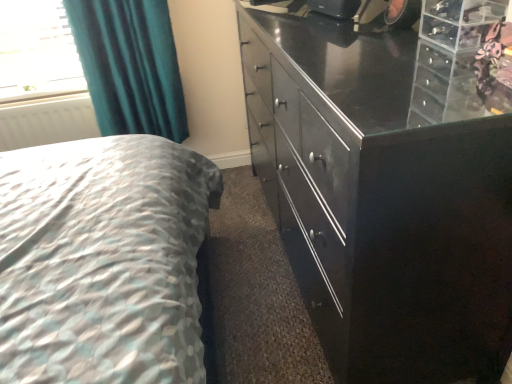
Question: From the image's perspective, is teal fabric curtain at upper left above or below glossy black cabinet at right?

Choices:
 (A) above
 (B) below

Answer: (A)

Question: From a real-world perspective, is teal fabric curtain at upper left positioned above or below glossy black cabinet at right?

Choices:
 (A) below
 (B) above

Answer: (B)

Question: Which is farther from the glossy black cabinet at right?

Choices:
 (A) teal fabric curtain at upper left
 (B) white matte radiator at left

Answer: (B)

Question: Estimate the real-world distances between objects in this image. Which object is farther from the glossy black cabinet at right?

Choices:
 (A) teal fabric curtain at upper left
 (B) white matte radiator at left

Answer: (B)